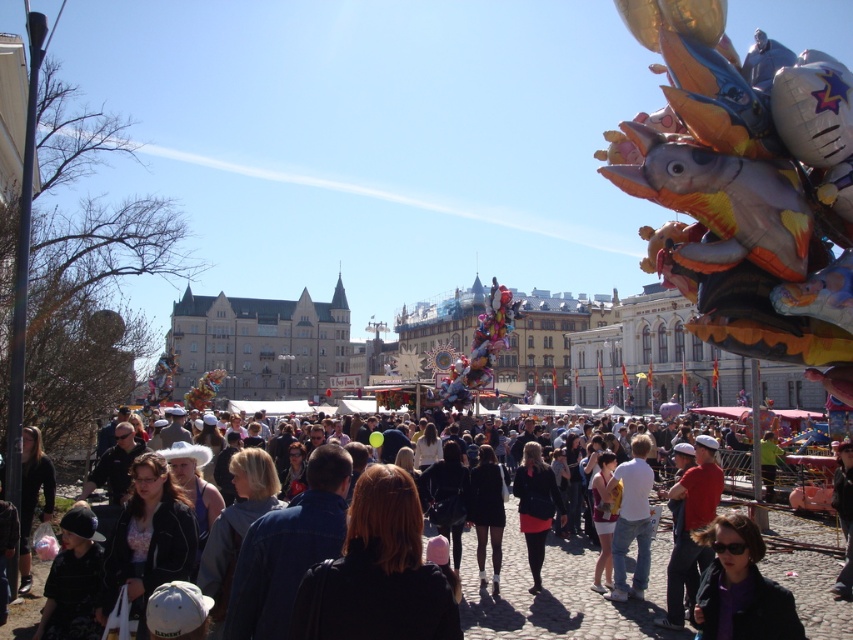
You are at the festival and want to find the red shirt at center. Which direction should you look relative to the purple matte jacket at lower right?

The purple matte jacket at lower right is above the red shirt at center, so you should look downward from the purple matte jacket at lower right to find the red shirt at center.

You are at the festival and want to find the person wearing the purple matte jacket at lower right and the red shirt at center. Which of the two items of clothing takes up more visual space in the image?

The red shirt at center takes up more visual space than the purple matte jacket at lower right because the purple matte jacket at lower right occupies less space than red shirt at center.

You are standing at the center of the cobblestone street and see the purple matte jacket at lower right. Can you determine its exact position relative to the stalls in the midground?

The purple matte jacket at lower right is located at point (x=740, y=586), which is in the lower right area of the image, closer to the foreground crowd rather than the midground stalls.